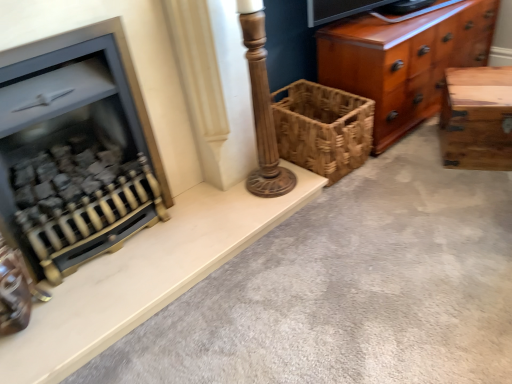
Identify the location of vacant area that is in front of wooden column at center. The height and width of the screenshot is (384, 512). (260, 207).